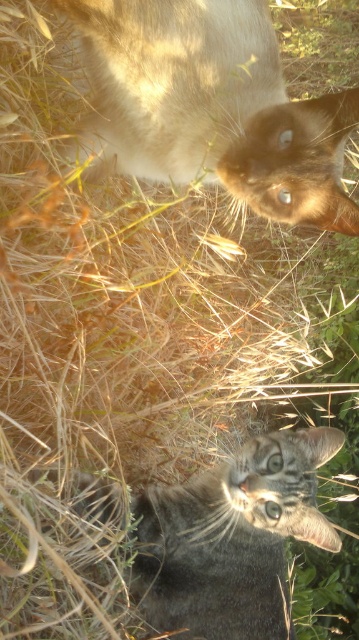
Looking at this image, is brown fur cat at upper center to the left of gray tabby cat at lower center from the viewer's perspective?

Indeed, brown fur cat at upper center is positioned on the left side of gray tabby cat at lower center.

Can you confirm if brown fur cat at upper center is positioned above gray tabby cat at lower center?

Yes.

The image size is (359, 640). Find the location of `brown fur cat at upper center`. brown fur cat at upper center is located at coordinates (212, 106).